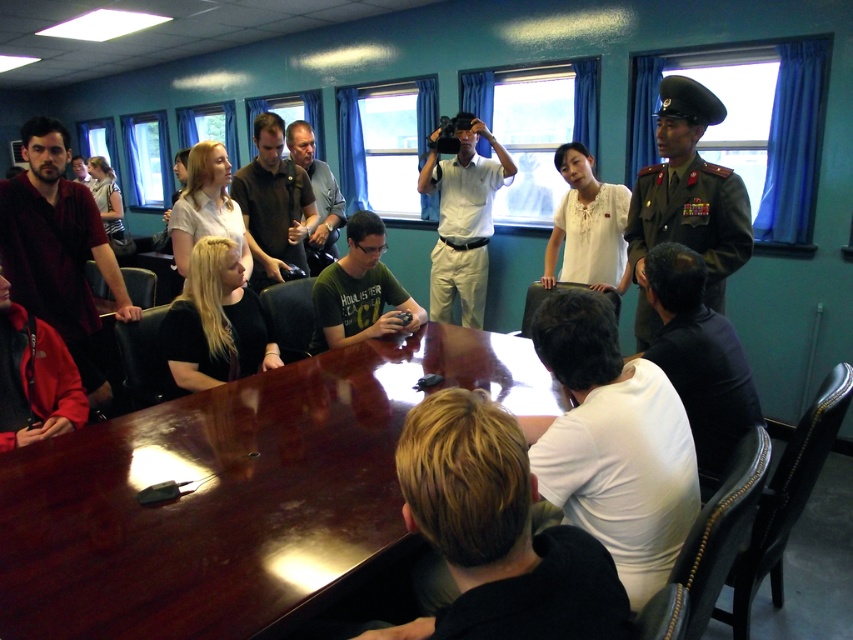
From the picture: You are a photographer trying to capture a clear shot of the white cotton shirt at center and the dark brown hair at center. Based on their positions, which one should you focus on first to ensure both are in frame?

Since the dark brown hair at center is to the left of the white cotton shirt at center, you should focus on the white cotton shirt at center first, then adjust to include the dark brown hair at center to its left.

You are standing in the meeting room and want to take a photo of the glossy wood table at center. Where should you position yourself relative to the windows to ensure the table is well lit?

The glossy wood table at center is located at point 0.773 on the x axis and 0.275 on the y axis. To ensure proper lighting, position yourself so that the windows are to your back, facing the table. This way, the natural light from the windows will illuminate the table evenly.